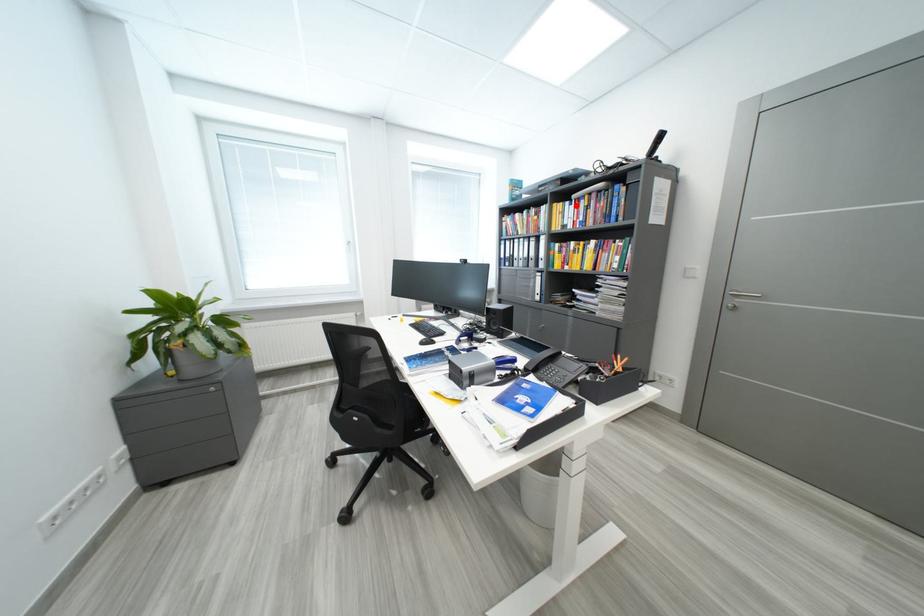
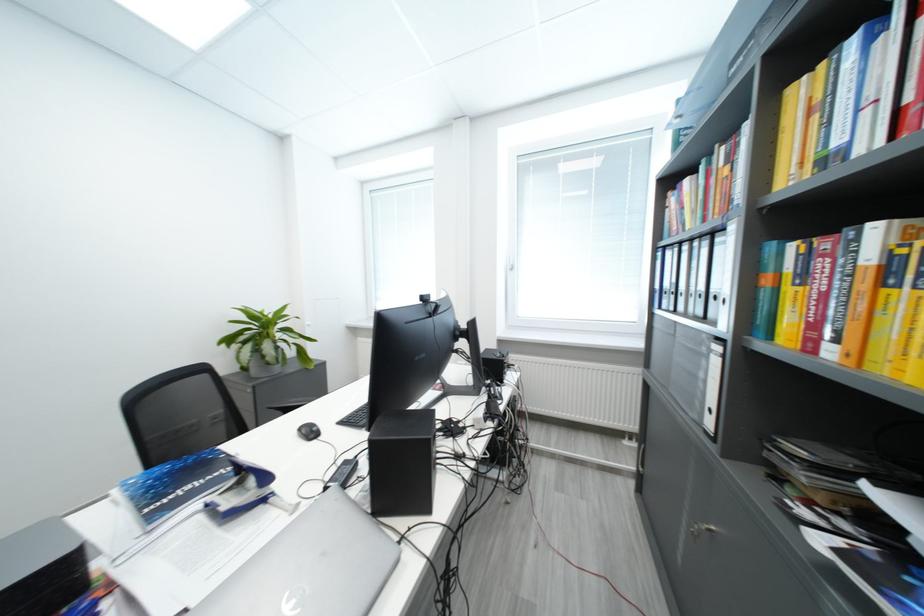
Question: I am providing you with two images of the same scene from different viewpoints. A red point is marked on the first image. At the location where the point appears in image 1, is it still visible in image 2?

Choices:
 (A) Yes
 (B) No

Answer: (A)